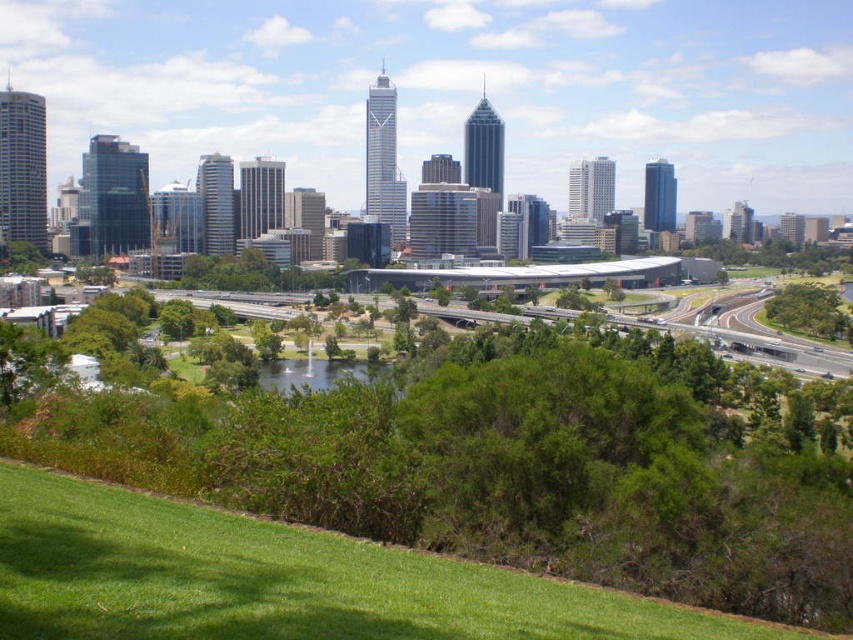
Is green grassy park at center to the left of green asphalt highway at center from the viewer's perspective?

Yes, green grassy park at center is to the left of green asphalt highway at center.

Does green grassy park at center have a lesser width compared to green asphalt highway at center?

No, green grassy park at center is not thinner than green asphalt highway at center.

I want to click on green grassy park at center, so click(519, 461).